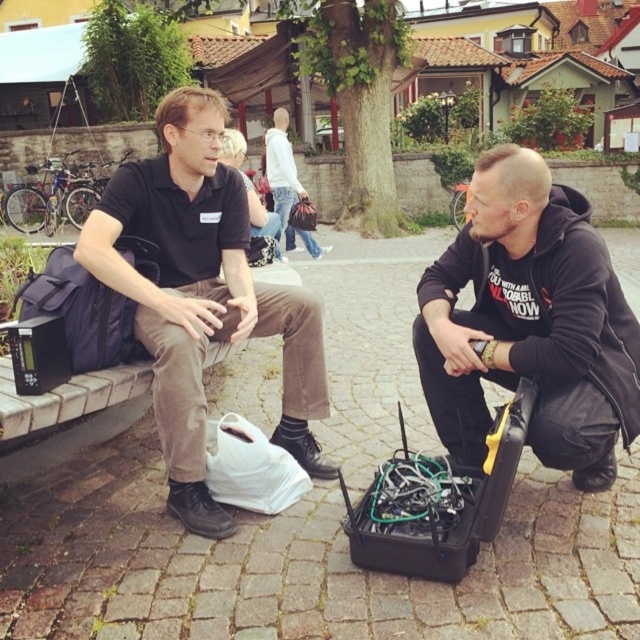
Is black hoodie at center bigger than black cotton shirt at left?

No, black hoodie at center is not bigger than black cotton shirt at left.

Can you confirm if black hoodie at center is positioned to the left of black cotton shirt at left?

In fact, black hoodie at center is to the right of black cotton shirt at left.

Is point (456, 336) farther from viewer compared to point (236, 252)?

No, it is in front of (236, 252).

Where is `black hoodie at center`? black hoodie at center is located at coordinates (529, 323).